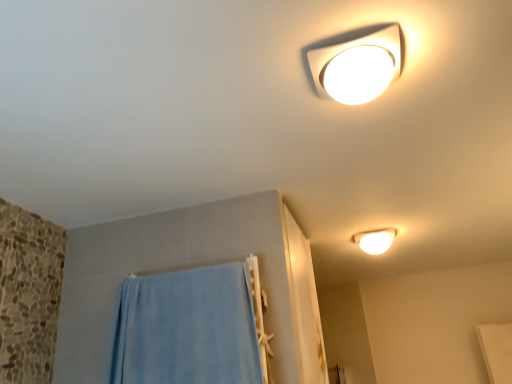
Question: From a real-world perspective, is blue soft towel at lower left above or below white glossy light fixture at upper right, arranged as the 2th lamp when viewed from the front?

Choices:
 (A) below
 (B) above

Answer: (A)

Question: Is blue soft towel at lower left bigger or smaller than white glossy light fixture at upper right, acting as the first lamp starting from the right?

Choices:
 (A) big
 (B) small

Answer: (A)

Question: Estimate the real-world distances between objects in this image. Which object is closer to the blue soft towel at lower left?

Choices:
 (A) white glossy light fixture at upper right, which ranks as the 2th lamp in left-to-right order
 (B) white glossy lamp at upper center, the 2th lamp positioned from the right

Answer: (B)

Question: Which object is the closest to the white glossy light fixture at upper right, which ranks as the 2th lamp in left-to-right order?

Choices:
 (A) blue soft towel at lower left
 (B) white glossy lamp at upper center, the 2th lamp positioned from the right

Answer: (A)